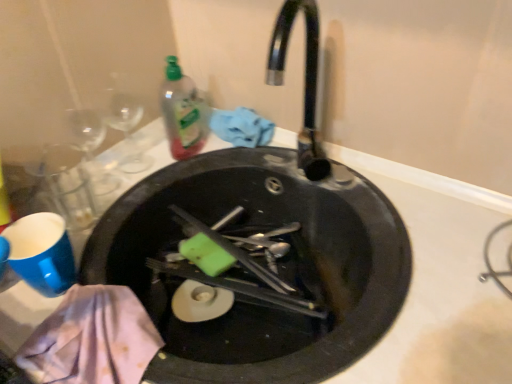
Question: Is black matte sink at center in front of or behind translucent plastic bottle at upper center in the image?

Choices:
 (A) front
 (B) behind

Answer: (A)

Question: Which is correct: black matte sink at center is inside translucent plastic bottle at upper center, or outside of it?

Choices:
 (A) inside
 (B) outside

Answer: (B)

Question: From a real-world perspective, relative to translucent plastic bottle at upper center, is black matte sink at center vertically above or below?

Choices:
 (A) above
 (B) below

Answer: (B)

Question: From a real-world perspective, is translucent plastic bottle at upper center physically located above or below black matte sink at center?

Choices:
 (A) below
 (B) above

Answer: (B)

Question: Considering the positions of translucent plastic bottle at upper center and black matte sink at center in the image, is translucent plastic bottle at upper center bigger or smaller than black matte sink at center?

Choices:
 (A) big
 (B) small

Answer: (B)

Question: Does point (197, 114) appear closer or farther from the camera than point (303, 377)?

Choices:
 (A) closer
 (B) farther

Answer: (B)

Question: Is translucent plastic bottle at upper center wider or thinner than black matte sink at center?

Choices:
 (A) thin
 (B) wide

Answer: (A)